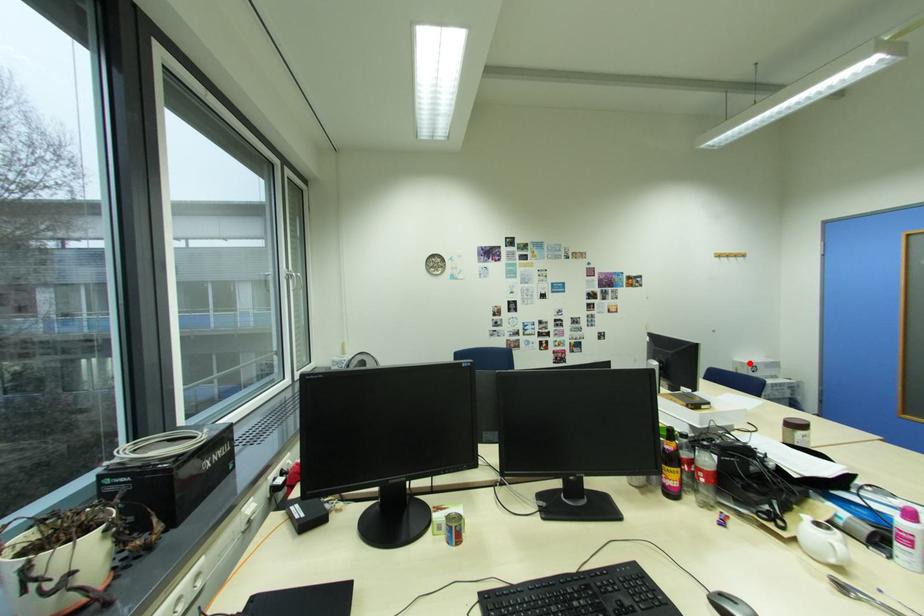
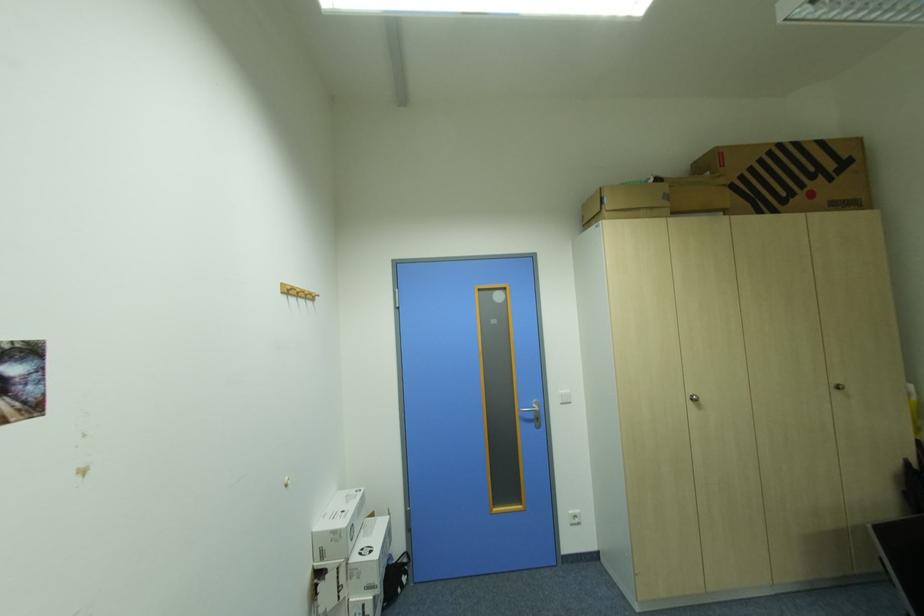
Locate, in the second image, the point that corresponds to the highlighted location in the first image.

(341, 533)